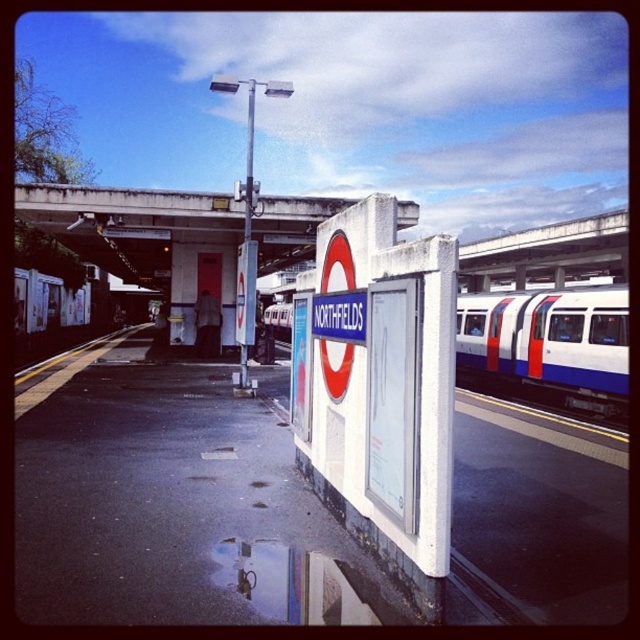
Which of these two, white glossy train at center or concrete at upper center, stands shorter?

white glossy train at center

The width and height of the screenshot is (640, 640). What do you see at coordinates (547, 348) in the screenshot? I see `white glossy train at center` at bounding box center [547, 348].

At what (x,y) coordinates should I click in order to perform the action: click on white glossy train at center. Please return your answer as a coordinate pair (x, y). Looking at the image, I should click on (547, 348).

Can you confirm if white concrete signboard at center is positioned above white glossy train at center?

Correct, white concrete signboard at center is located above white glossy train at center.

Can you confirm if white concrete signboard at center is positioned to the right of white glossy train at center?

Indeed, white concrete signboard at center is positioned on the right side of white glossy train at center.

Is point (275, 221) behind point (461, 380)?

No.

This screenshot has height=640, width=640. What are the coordinates of `white concrete signboard at center` in the screenshot? It's located at (168, 497).

Can you confirm if white concrete signboard at center is positioned below concrete at upper center?

Correct, white concrete signboard at center is located below concrete at upper center.

Looking at this image, between white concrete signboard at center and concrete at upper center, which one has less height?

white concrete signboard at center is shorter.

Who is more distant from viewer, [547,513] or [36,193]?

Point [36,193]

I want to click on white concrete signboard at center, so click(x=168, y=497).